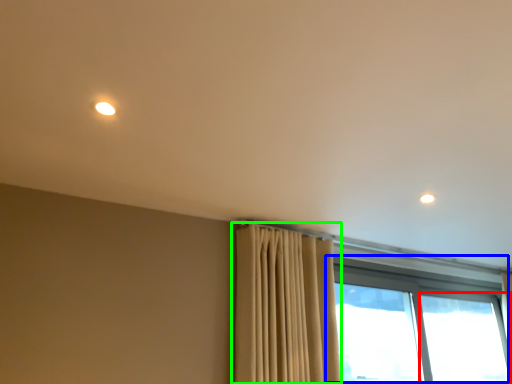
Question: Considering the real-world distances, which object is closest to window (highlighted by a red box)? window (highlighted by a blue box) or curtain (highlighted by a green box).

Choices:
 (A) window
 (B) curtain

Answer: (A)